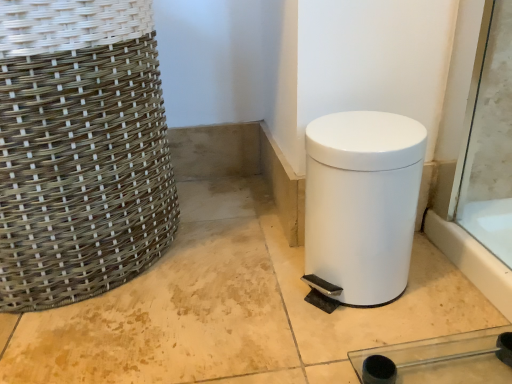
Question: Relative to woven natural fiber basket at left, is white matte waste container at lower right in front or behind?

Choices:
 (A) front
 (B) behind

Answer: (B)

Question: From their relative heights in the image, would you say white matte waste container at lower right is taller or shorter than woven natural fiber basket at left?

Choices:
 (A) tall
 (B) short

Answer: (B)

Question: In the image, is white matte waste container at lower right on the left side or the right side of woven natural fiber basket at left?

Choices:
 (A) left
 (B) right

Answer: (B)

Question: Is woven natural fiber basket at left bigger or smaller than white matte waste container at lower right?

Choices:
 (A) small
 (B) big

Answer: (B)

Question: In the image, is woven natural fiber basket at left positioned in front of or behind white matte waste container at lower right?

Choices:
 (A) front
 (B) behind

Answer: (A)

Question: Is woven natural fiber basket at left inside the boundaries of white matte waste container at lower right, or outside?

Choices:
 (A) inside
 (B) outside

Answer: (B)

Question: In terms of width, does woven natural fiber basket at left look wider or thinner when compared to white matte waste container at lower right?

Choices:
 (A) thin
 (B) wide

Answer: (B)